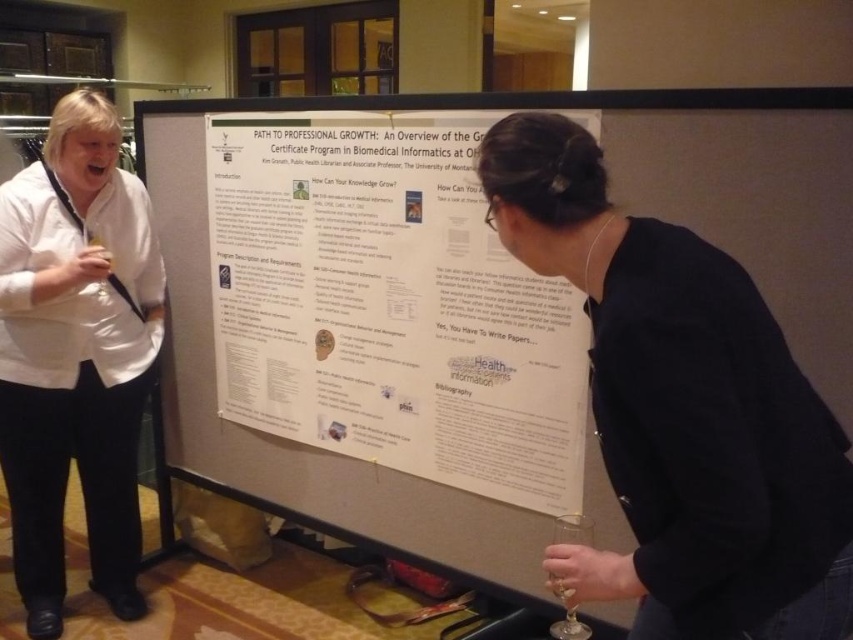
In the scene shown: Measure the distance between black matte poster at center and camera.

A distance of 93.16 centimeters exists between black matte poster at center and camera.

This screenshot has height=640, width=853. Describe the element at coordinates (682, 410) in the screenshot. I see `black matte poster at center` at that location.

Where is `black matte poster at center`? black matte poster at center is located at coordinates 682,410.

Who is more forward, (448, 448) or (567, 532)?

Point (567, 532)

You are a GUI agent. You are given a task and a screenshot of the screen. Output one action in this format:
    pyautogui.click(x=<x>, y=<y>)
    Task: Click on the white paper poster at center
    This screenshot has width=853, height=640.
    Given the screenshot: What is the action you would take?
    pyautogui.click(x=389, y=305)

Between black matte poster at center and transparent glass at upper left, which one appears on the left side from the viewer's perspective?

transparent glass at upper left is more to the left.

Based on the photo, does black matte poster at center appear on the left side of transparent glass at upper left?

No, black matte poster at center is not to the left of transparent glass at upper left.

The width and height of the screenshot is (853, 640). What are the coordinates of `black matte poster at center` in the screenshot? It's located at (682, 410).